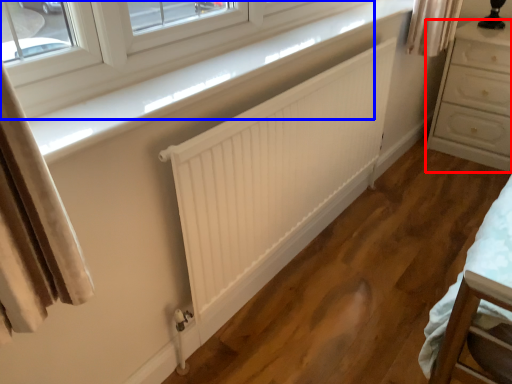
Question: Which of the following is the farthest to the observer, chest of drawers (highlighted by a red box) or window (highlighted by a blue box)?

Choices:
 (A) chest of drawers
 (B) window

Answer: (A)